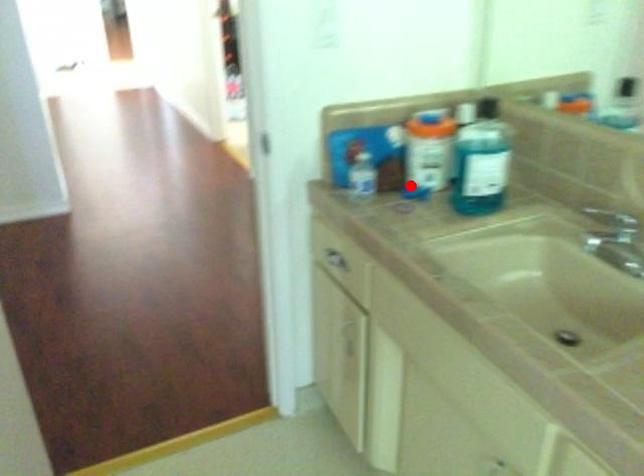
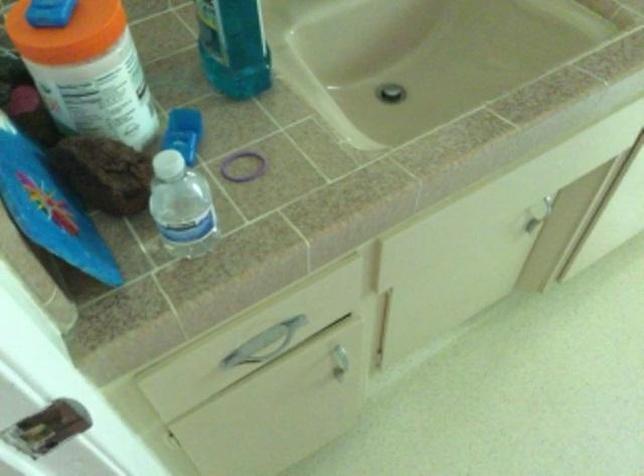
Where in the second image is the point corresponding to the highlighted location from the first image?

(104, 173)